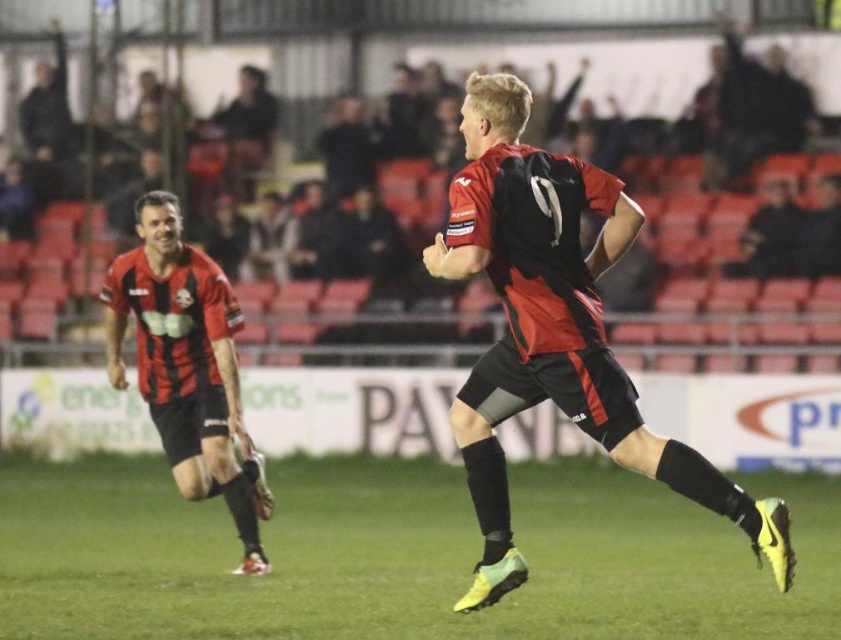
Question: Which object is closer to the camera taking this photo?

Choices:
 (A) yellow synthetic turf at center
 (B) matte black jersey at left

Answer: (A)

Question: Among these objects, which one is nearest to the camera?

Choices:
 (A) matte black jersey at center
 (B) yellow synthetic turf at center
 (C) matte black jersey at left

Answer: (A)

Question: Which point is farther from the camera taking this photo?

Choices:
 (A) (799, 634)
 (B) (516, 404)

Answer: (A)

Question: Is yellow synthetic turf at center to the right of matte black jersey at left from the viewer's perspective?

Choices:
 (A) no
 (B) yes

Answer: (B)

Question: Is yellow synthetic turf at center above matte black jersey at center?

Choices:
 (A) yes
 (B) no

Answer: (B)

Question: Is matte black jersey at center thinner than matte black jersey at left?

Choices:
 (A) yes
 (B) no

Answer: (B)